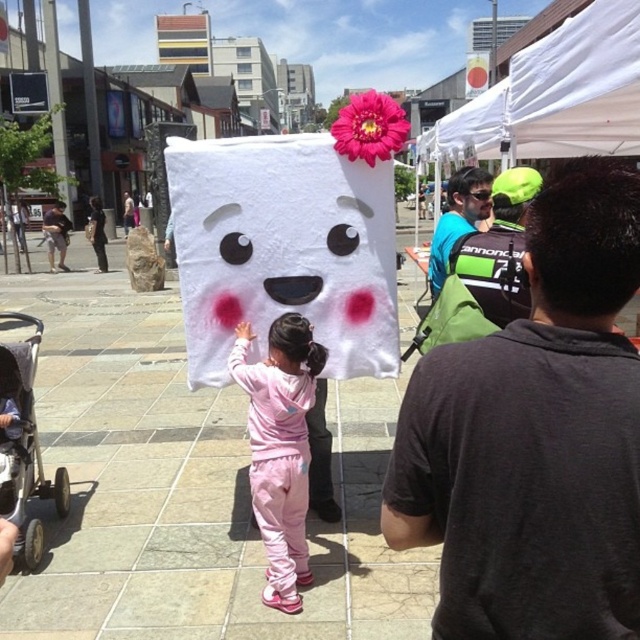
Question: Among these points, which one is farthest from the camera?

Choices:
 (A) (547, 564)
 (B) (481, 218)
 (C) (8, 428)

Answer: (B)

Question: Does dark gray t-shirt at center appear on the left side of blue fabric shirt at upper right?

Choices:
 (A) yes
 (B) no

Answer: (A)

Question: Is white fabric canopy at upper center closer to the viewer compared to blue fabric backpack at upper right?

Choices:
 (A) yes
 (B) no

Answer: (B)

Question: Does gray fabric stroller at lower left lie in front of matte black sunglasses at upper center?

Choices:
 (A) no
 (B) yes

Answer: (B)

Question: Which object appears farthest from the camera in this image?

Choices:
 (A) light brown leather jacket at left
 (B) matte black sunglasses at upper center
 (C) blue fabric shirt at upper right
 (D) gray fabric stroller at lower left

Answer: (A)

Question: Which of the following is the closest to the observer?

Choices:
 (A) dark gray t-shirt at center
 (B) light brown leather jacket at left
 (C) matte black sunglasses at upper center
 (D) white fabric canopy at upper center

Answer: (A)